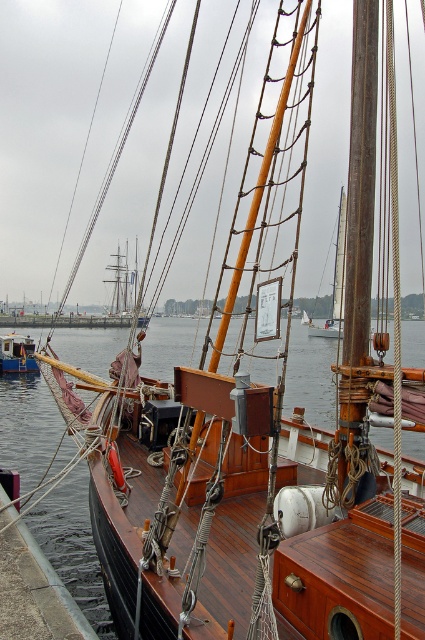
You are a sailor on the deck of the boat. You need to climb the wooden mast at center but first must avoid stepping into the transparent water at center. Based on their positions, which object is closer to you as you stand on the deck?

The transparent water at center is closer to you than the wooden mast at center because it is in front of the wooden mast at center.

You are standing on the deck of the wooden boat at lower left and want to climb the wooden mast at center. Which direction should you move to reach the mast?

You should move to your right to reach the wooden mast at center because it is located to the right of the wooden boat at lower left.